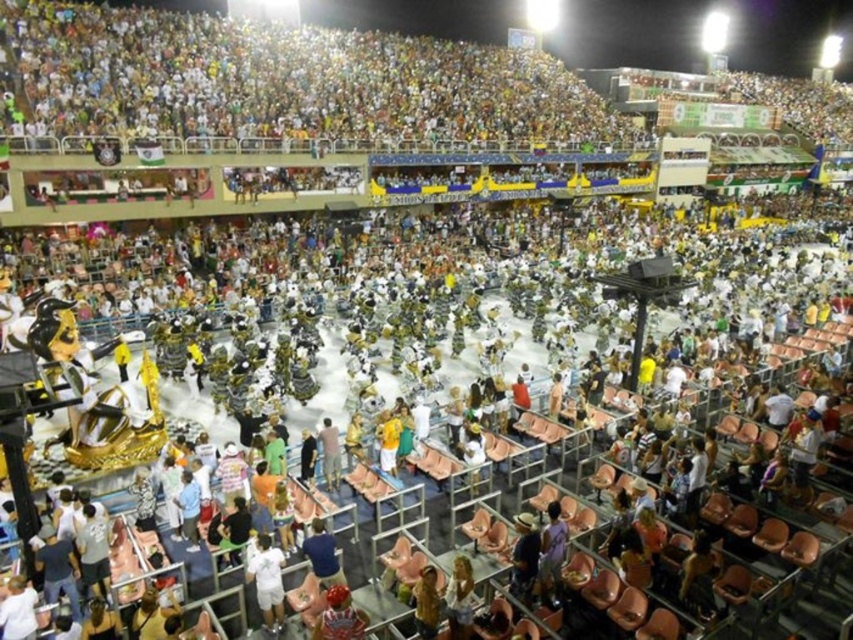
You are a photographer positioned at the edge of the stage. You want to capture a photo that includes both the white matte shirt at lower center and the light brown leather jacket at center. Given that your camera has a maximum focus range of 15 feet, will you be able to capture both subjects in focus without moving your position?

The white matte shirt at lower center is 17.67 feet from the light brown leather jacket at center. Since the distance between them exceeds the camera maximum focus range of 15 feet, you will not be able to capture both subjects in focus without moving your position.

You are standing at the center of the tiered seating area and want to locate the white matte shirt at lower center. According to the coordinates provided, in which direction should you look relative to your position?

The white matte shirt at lower center is located at coordinates point (x=267, y=580), which corresponds to the lower center area of the image. Since you are at the center of the tiered seating, looking towards the lower center direction would place your gaze downward and slightly forward, towards the central stage area where the performers are located.

Based on the photo, you are standing at the back of the tiered seating watching the carnival performance. You want to take a photo of the white matte shirt at lower center from where you are. Considering the distance, is it possible to capture a clear closeup without moving closer?

The white matte shirt at lower center is 15.63 meters away from the viewer. At this distance, capturing a clear closeup photo without moving closer would require a camera with a powerful zoom lens capable of resolving details at such a range. Standard smartphone cameras may struggle with this distance, but professional equipment could achieve it.